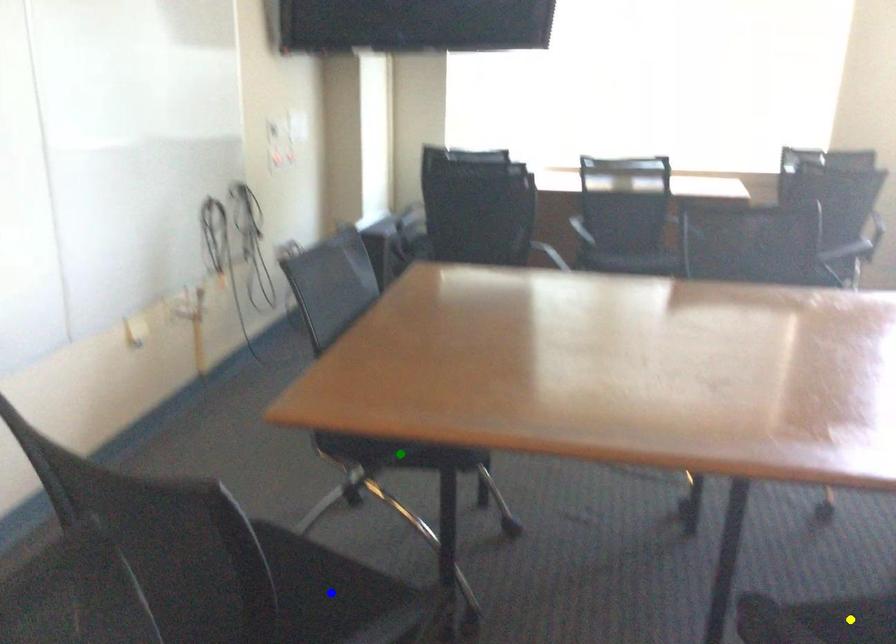
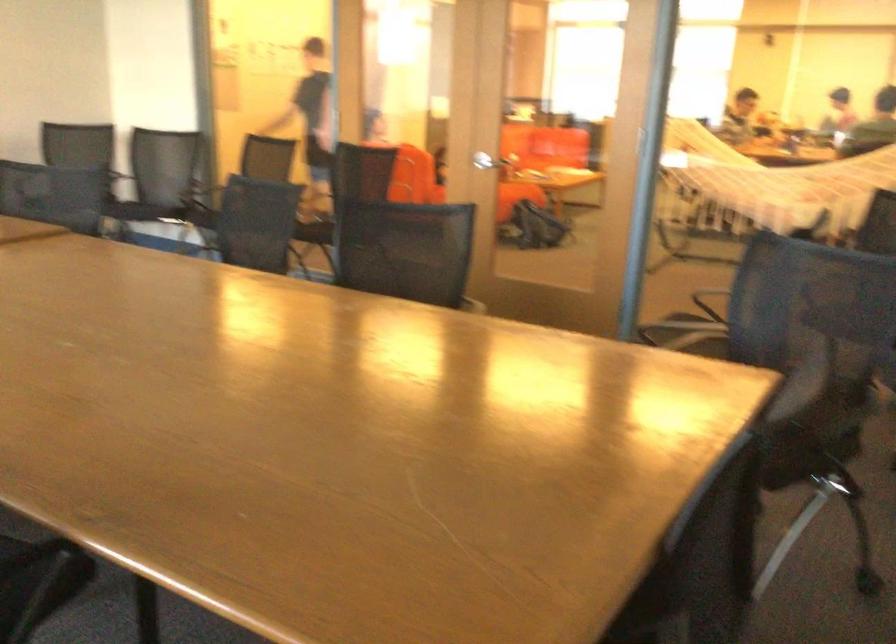
I am providing you with two images of the same scene from different viewpoints. Three points are marked in image1. Which point corresponds to a part or object that is occluded in image2?In image1, three points are marked. Which of them correspond to a part or object that is occluded in image2?Among the three points shown in image1, which one corresponds to a part or object that is no longer visible due to occlusion in image2?

yellow point, blue point, green point cannot be seen in image2.